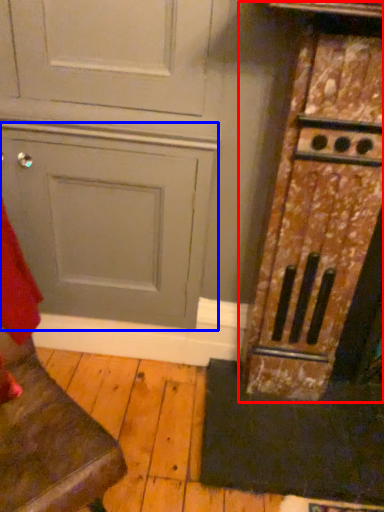
Question: Which object appears farthest to the camera in this image, cabinetry (highlighted by a red box) or door (highlighted by a blue box)?

Choices:
 (A) cabinetry
 (B) door

Answer: (B)